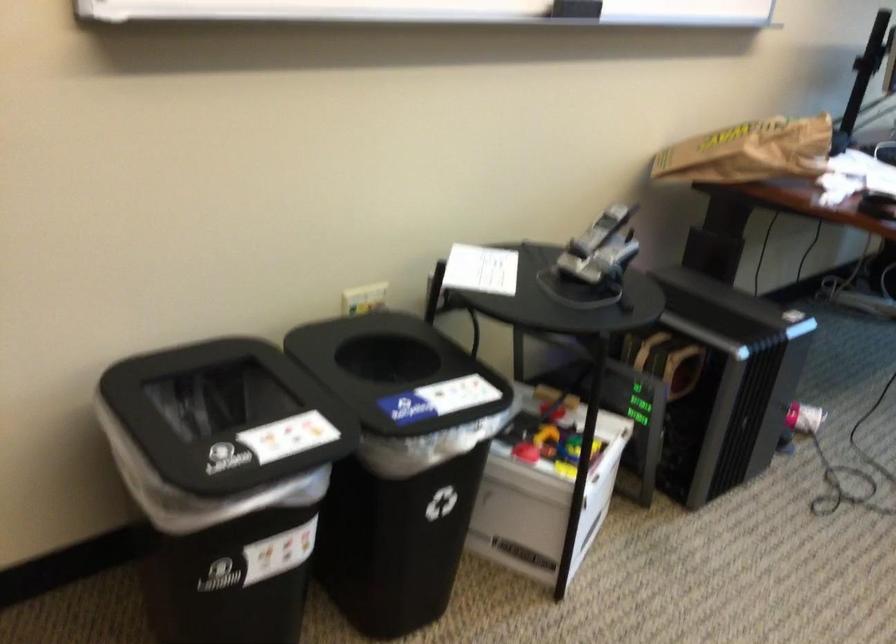
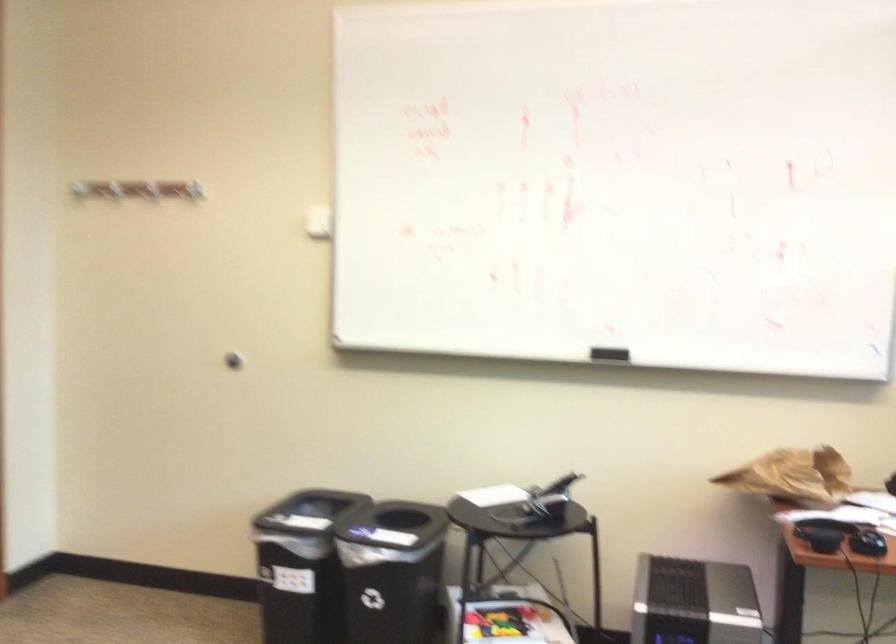
In the second image, find the point that corresponds to (806,152) in the first image.

(794, 476)